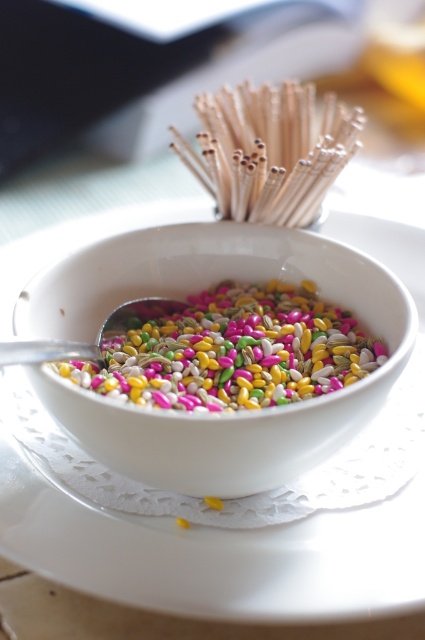
Question: Which of the following is the farthest from the observer?

Choices:
 (A) metallic silver spoon at center
 (B) wooden chopsticks at upper center
 (C) multicolored coated seeds at center
 (D) white glossy bowl at center

Answer: (B)

Question: Can you confirm if wooden chopsticks at upper center is positioned to the right of metallic silver spoon at center?

Choices:
 (A) yes
 (B) no

Answer: (A)

Question: Which of these objects is positioned closest to the metallic silver spoon at center?

Choices:
 (A) white glossy bowl at center
 (B) multicolored coated seeds at center

Answer: (B)

Question: Which point is farther to the camera?

Choices:
 (A) wooden chopsticks at upper center
 (B) metallic silver spoon at center
 (C) white glossy bowl at center
 (D) multicolored coated seeds at center

Answer: (A)

Question: Is wooden chopsticks at upper center to the right of metallic silver spoon at center from the viewer's perspective?

Choices:
 (A) yes
 (B) no

Answer: (A)

Question: Can you confirm if wooden chopsticks at upper center is positioned below metallic silver spoon at center?

Choices:
 (A) yes
 (B) no

Answer: (B)